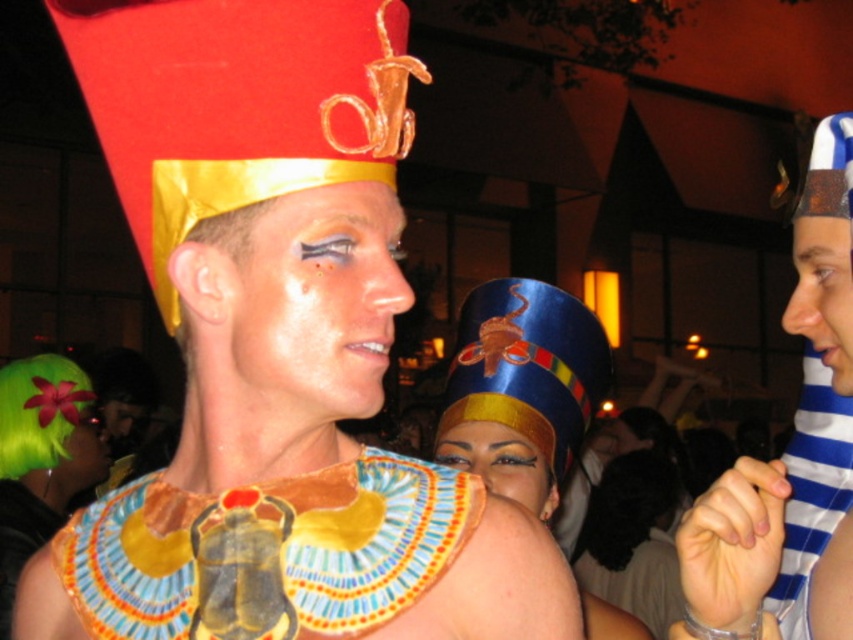
You are a photographer at the event and need to capture a closeup shot of the shiny gold face paint at center and the green fuzzy wig at lower left. Since your camera can only focus on one subject at a time, which object should you prioritize to ensure it fits entirely within the frame?

The shiny gold face paint at center should be prioritized because it occupies less space than the green fuzzy wig at lower left, making it easier to fit entirely within the camera frame.

You are at a costume party and see two people. One has shiny gold face paint at center and the other has green fuzzy wig at lower left. Which one is positioned more to the right side of the scene?

The shiny gold face paint at center is positioned more to the right side of the scene than the green fuzzy wig at lower left.